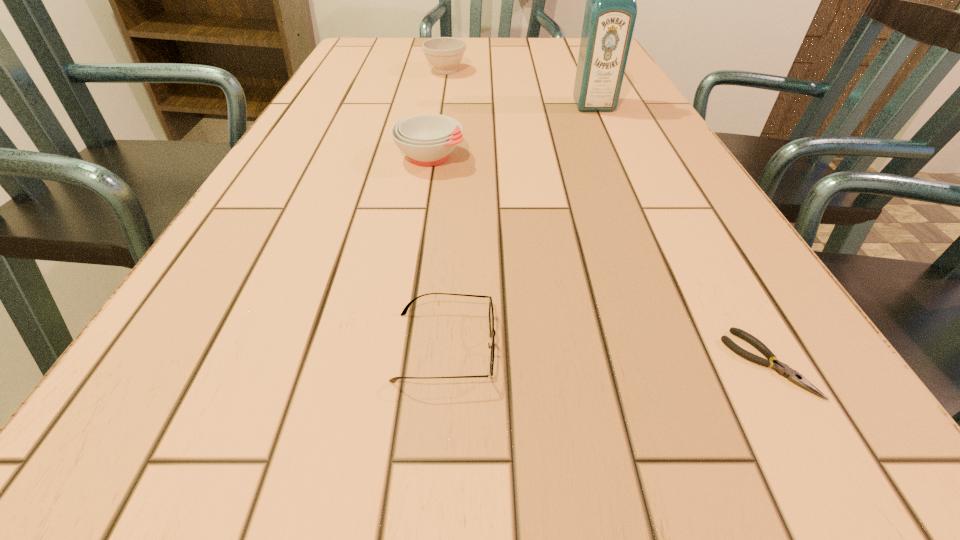
Find the location of a particular element. Image resolution: width=960 pixels, height=540 pixels. vacant region that satisfies the following two spatial constraints: 1. on the flat label side of the pliers; 2. on the left side of the liquor is located at coordinates (709, 363).

I want to click on free location that satisfies the following two spatial constraints: 1. on the front-facing side of the shortest object; 2. on the left side of the spectacles, so click(x=444, y=363).

You are a GUI agent. You are given a task and a screenshot of the screen. Output one action in this format:
    pyautogui.click(x=<x>, y=<y>)
    Task: Click on the free region that satisfies the following two spatial constraints: 1. on the flat label side of the liquor; 2. on the front-facing side of the spectacles
    
    Given the screenshot: What is the action you would take?
    pyautogui.click(x=702, y=347)

This screenshot has height=540, width=960. Find the location of `free location that satisfies the following two spatial constraints: 1. on the front-facing side of the spectacles; 2. on the left side of the shortest object`. free location that satisfies the following two spatial constraints: 1. on the front-facing side of the spectacles; 2. on the left side of the shortest object is located at coordinates (444, 363).